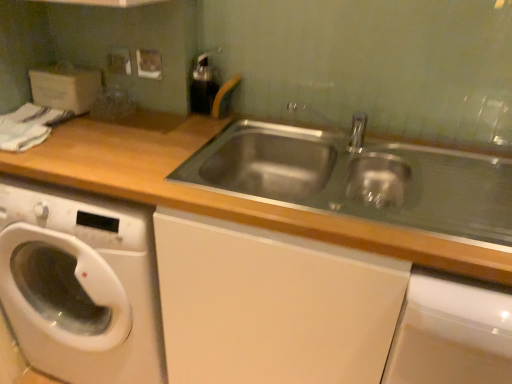
Question: Is wooden at left located outside metallic silver electric outlet at upper left?

Choices:
 (A) no
 (B) yes

Answer: (B)

Question: From a real-world perspective, is wooden at left located beneath metallic silver electric outlet at upper left?

Choices:
 (A) no
 (B) yes

Answer: (B)

Question: Considering the relative positions of wooden at left and metallic silver electric outlet at upper left in the image provided, is wooden at left to the right of metallic silver electric outlet at upper left from the viewer's perspective?

Choices:
 (A) no
 (B) yes

Answer: (B)

Question: From the image's perspective, is wooden at left beneath metallic silver electric outlet at upper left?

Choices:
 (A) yes
 (B) no

Answer: (A)

Question: Is wooden at left shorter than metallic silver electric outlet at upper left?

Choices:
 (A) yes
 (B) no

Answer: (B)

Question: Is metallic silver electric outlet at upper left taller or shorter than white glossy washing machine at lower left?

Choices:
 (A) short
 (B) tall

Answer: (A)

Question: Is metallic silver electric outlet at upper left in front of or behind white glossy washing machine at lower left in the image?

Choices:
 (A) front
 (B) behind

Answer: (B)

Question: Is metallic silver electric outlet at upper left inside the boundaries of white glossy washing machine at lower left, or outside?

Choices:
 (A) outside
 (B) inside

Answer: (A)

Question: Considering the positions of metallic silver electric outlet at upper left and white glossy washing machine at lower left in the image, is metallic silver electric outlet at upper left wider or thinner than white glossy washing machine at lower left?

Choices:
 (A) thin
 (B) wide

Answer: (A)

Question: From the image's perspective, relative to white glossy washing machine at lower left, is wooden at left above or below?

Choices:
 (A) above
 (B) below

Answer: (B)

Question: Is point (70, 130) positioned closer to the camera than point (13, 269)?

Choices:
 (A) farther
 (B) closer

Answer: (B)

Question: From a real-world perspective, is wooden at left above or below white glossy washing machine at lower left?

Choices:
 (A) above
 (B) below

Answer: (A)

Question: Would you say wooden at left is to the left or to the right of white glossy washing machine at lower left in the picture?

Choices:
 (A) left
 (B) right

Answer: (B)

Question: Visually, is metallic silver electric outlet at upper left positioned to the left or to the right of wooden at left?

Choices:
 (A) left
 (B) right

Answer: (A)

Question: Is metallic silver electric outlet at upper left spatially inside wooden at left, or outside of it?

Choices:
 (A) inside
 (B) outside

Answer: (B)